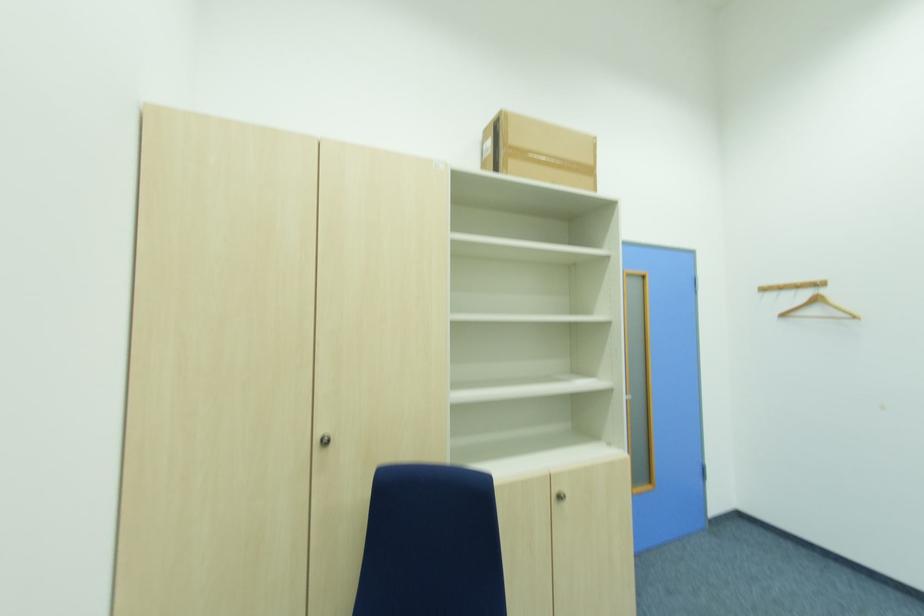
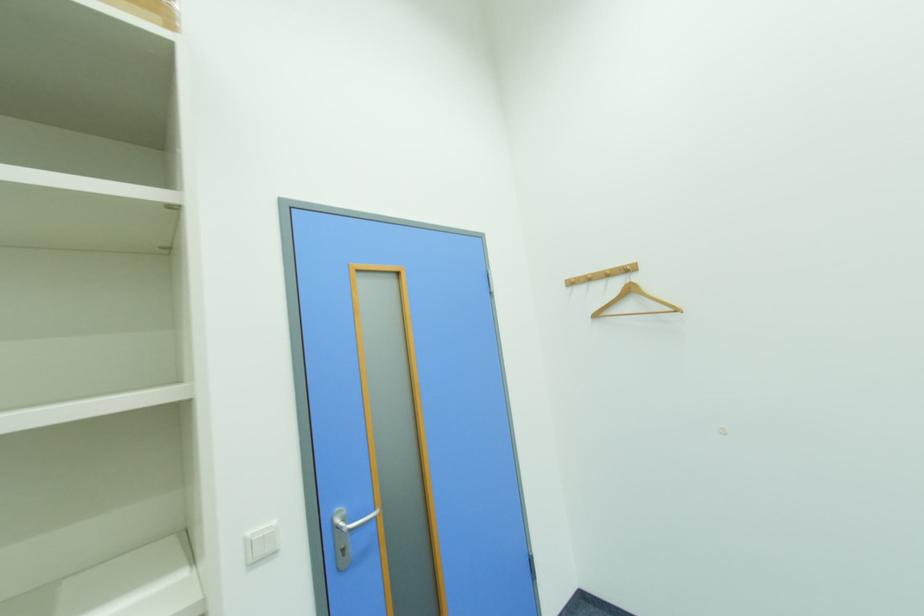
In the second image, find the point that corresponds to pixel 787 317 in the first image.

(601, 317)